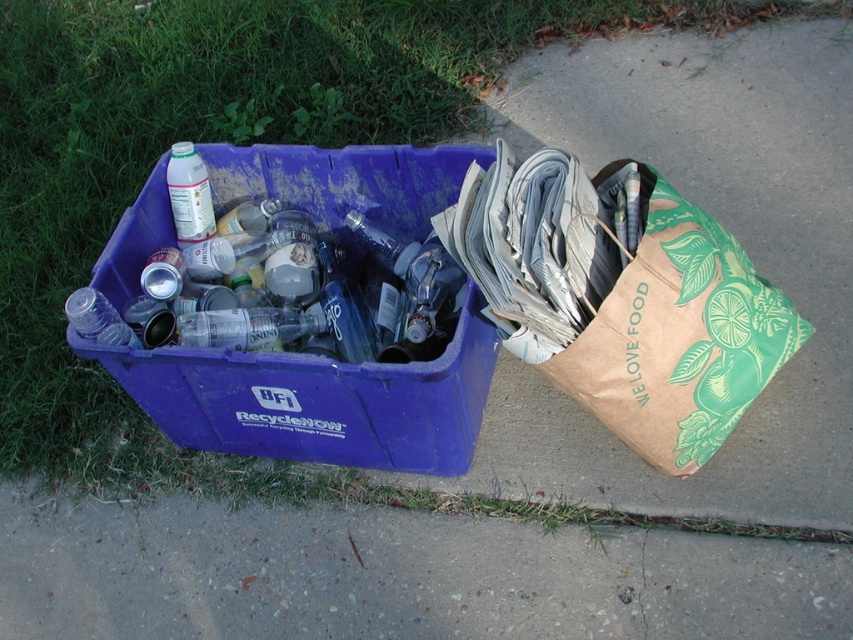
You are a waste management inspector checking the recycling setup. You notice the matte plastic recycling bin at left and the translucent plastic bottle at upper left. Which object is taller?

The matte plastic recycling bin at left is taller than the translucent plastic bottle at upper left.

You are standing in front of the recycling bin and need to place the transparent plastic bottle at left into the bin. However, you notice the brown paper bag at right nearby. Which item is closer to your current position?

The transparent plastic bottle at left is closer to your current position because the brown paper bag at right is located to the right of it, meaning the bottle is between you and the bag.

You are standing in front of the recycling setup and need to place a new item into the correct bin. The item you have is a clear plastic bottle that matches the translucent plastic bottle at upper left. Where should you place it? Is it in the matte plastic recycling bin at left or to the right of it?

The translucent plastic bottle at upper left is located to the left of the matte plastic recycling bin at left. Therefore, you should place your item into the matte plastic recycling bin at left since it is the recycling bin designated for such items.